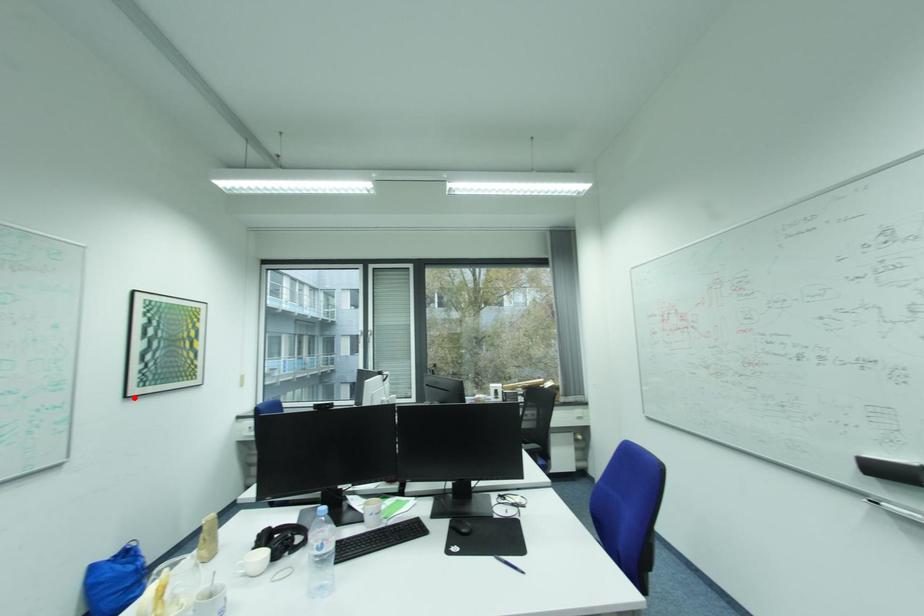
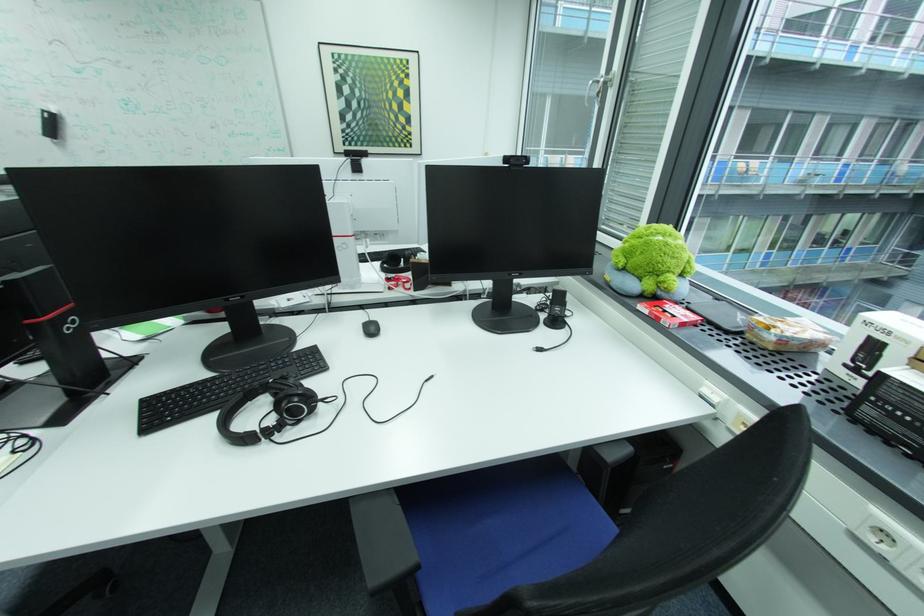
Where in the second image is the point corresponding to the highlighted location from the first image?

(344, 153)